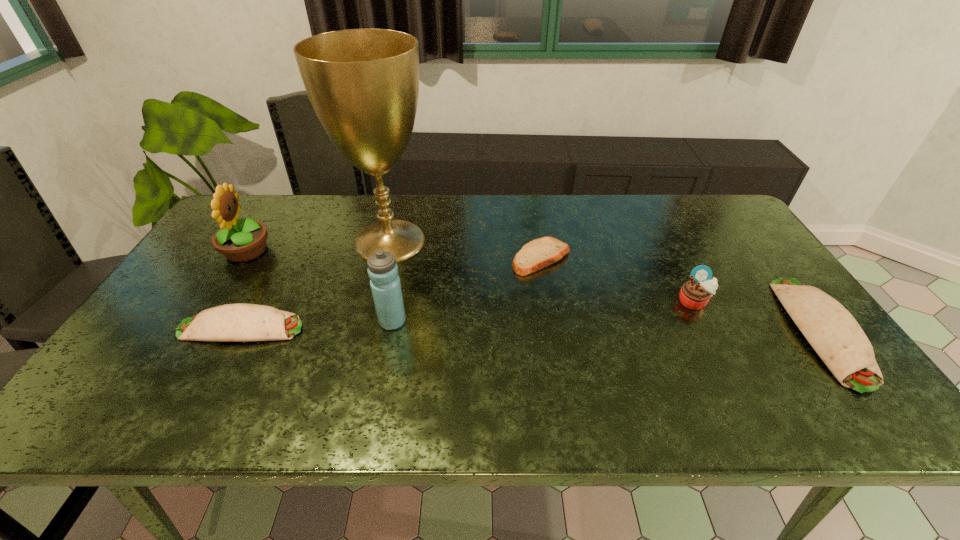
You are a GUI agent. You are given a task and a screenshot of the screen. Output one action in this format:
    pyautogui.click(x=<x>, y=<y>)
    Task: Click on the second shortest object
    This screenshot has height=540, width=960.
    Given the screenshot: What is the action you would take?
    pyautogui.click(x=236, y=322)

Find the location of a particular element. Image resolution: width=960 pixels, height=540 pixels. the left burrito is located at coordinates (236, 322).

The height and width of the screenshot is (540, 960). What are the coordinates of `the right burrito` in the screenshot? It's located at point(835,335).

This screenshot has height=540, width=960. Identify the location of the fifth tallest object. (835, 335).

I want to click on the tallest object, so click(x=363, y=84).

Locate an element on the screen. The height and width of the screenshot is (540, 960). muffin is located at coordinates (695, 294).

Find the location of a particular element. the sixth object from left to right is located at coordinates (695, 294).

In order to click on water bottle in this screenshot , I will do `click(382, 269)`.

The height and width of the screenshot is (540, 960). I want to click on sunflower, so [x=238, y=240].

The width and height of the screenshot is (960, 540). Find the location of `the shortest object`. the shortest object is located at coordinates (537, 254).